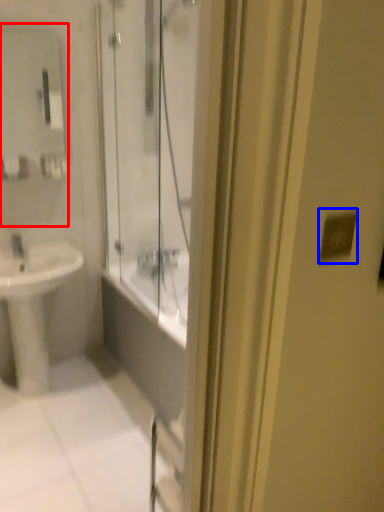
Question: Which point is further to the camera, mirror (highlighted by a red box) or light switch (highlighted by a blue box)?

Choices:
 (A) mirror
 (B) light switch

Answer: (A)